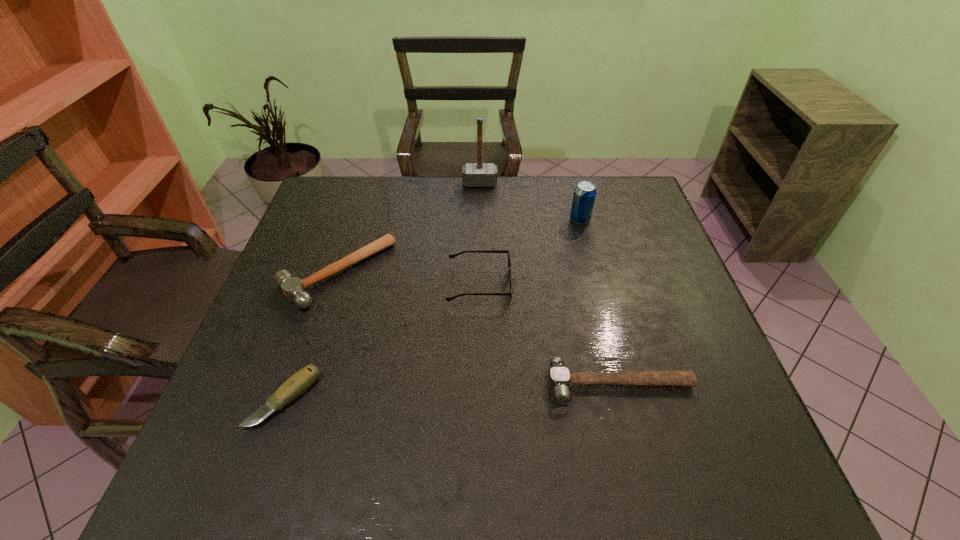
Image resolution: width=960 pixels, height=540 pixels. Find the location of `free location located 0.070m on the right of the fifth shortest object`. free location located 0.070m on the right of the fifth shortest object is located at coordinates (613, 220).

At what (x,y) coordinates should I click in order to perform the action: click on free space located on the front lenses of the third tallest object. Please return your answer as a coordinate pair (x, y). Image resolution: width=960 pixels, height=540 pixels. Looking at the image, I should click on (599, 285).

Image resolution: width=960 pixels, height=540 pixels. Identify the location of free point located 0.050m on the right of the leftmost hammer. (410, 273).

Find the location of `free space located on the striking face of the shortest hammer`. free space located on the striking face of the shortest hammer is located at coordinates (643, 477).

Where is `vacant space positioned 0.380m on the back of the pocketknife`? The height and width of the screenshot is (540, 960). vacant space positioned 0.380m on the back of the pocketknife is located at coordinates (335, 253).

The image size is (960, 540). Find the location of `hammer that is positioned at the far edge`. hammer that is positioned at the far edge is located at coordinates (479, 174).

You are a GUI agent. You are given a task and a screenshot of the screen. Output one action in this format:
    pyautogui.click(x=<x>, y=<y>)
    Task: Click on the beer can that is at the far edge
    The image size is (960, 540).
    Given the screenshot: What is the action you would take?
    pyautogui.click(x=584, y=195)

Image resolution: width=960 pixels, height=540 pixels. I want to click on hammer that is at the left edge, so click(293, 288).

Where is `pocketknife positioned at the left edge`? This screenshot has width=960, height=540. pocketknife positioned at the left edge is located at coordinates [302, 380].

Find the location of a particular element. The width and height of the screenshot is (960, 540). object situated at the right edge is located at coordinates (559, 376).